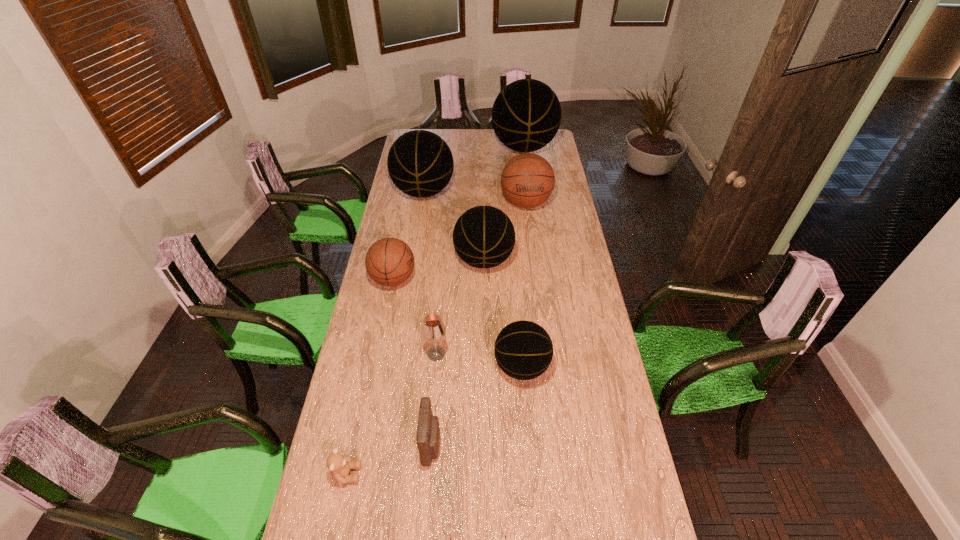
This screenshot has width=960, height=540. Identify the location of the nearest black basketball. (523, 350).

Image resolution: width=960 pixels, height=540 pixels. I want to click on wineglass, so click(433, 330).

The width and height of the screenshot is (960, 540). Find the location of `pouch`. pouch is located at coordinates (428, 430).

Locate an element on the screen. This screenshot has height=540, width=960. teddy bear is located at coordinates (339, 465).

What are the coordinates of `brown teddy bear` in the screenshot? It's located at (339, 465).

At what (x,y) coordinates should I click in order to perform the action: click on free spot located 0.190m on the left of the farthest black basketball. Please return your answer as a coordinate pair (x, y). The height and width of the screenshot is (540, 960). Looking at the image, I should click on (459, 148).

Find the location of `vacant area situated on the right of the leftmost black basketball`. vacant area situated on the right of the leftmost black basketball is located at coordinates (474, 192).

This screenshot has height=540, width=960. Identify the location of vacant region located on the side with brand label of the farther brown basketball. (534, 270).

Find the location of a particular element. This screenshot has width=960, height=540. vacant area located 0.280m on the back of the second smallest black basketball is located at coordinates (483, 205).

Image resolution: width=960 pixels, height=540 pixels. I want to click on vacant space located 0.280m on the side with brand label of the smaller brown basketball, so click(483, 279).